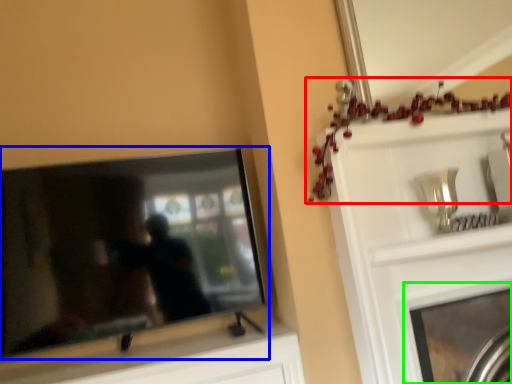
Question: Which object is positioned closest to christmas decoration (highlighted by a red box)? Select from television (highlighted by a blue box) and fireplace (highlighted by a green box).

Choices:
 (A) television
 (B) fireplace

Answer: (B)